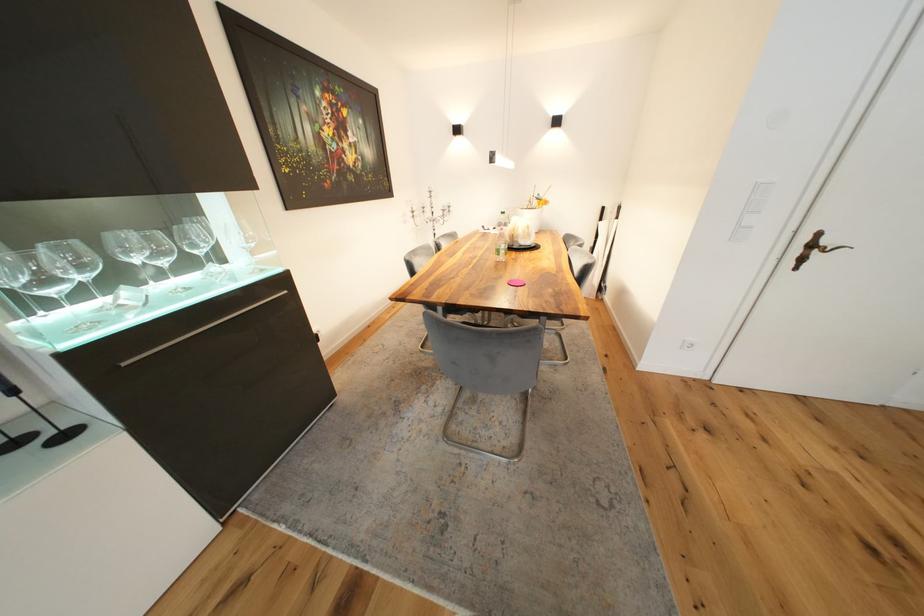
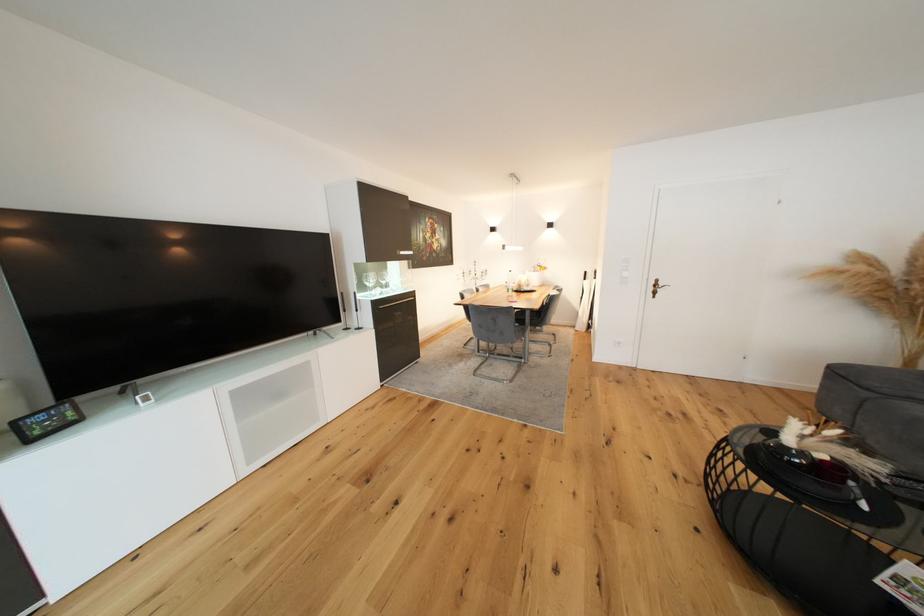
Question: The images are taken continuously from a first-person perspective. In which direction are you moving?

Choices:
 (A) Left
 (B) Right
 (C) Forward
 (D) Backward

Answer: (D)